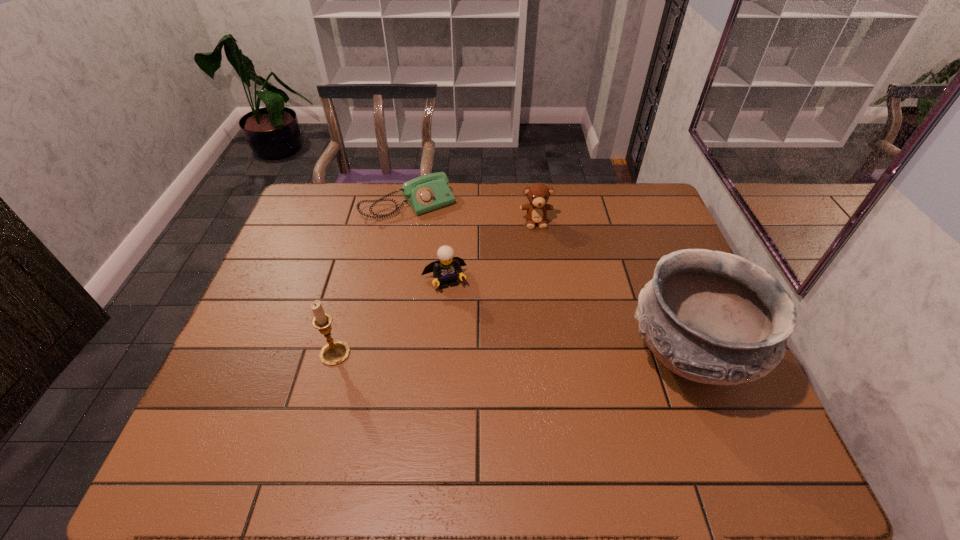
Locate an element on the screen. candle holder is located at coordinates (334, 353).

You are a GUI agent. You are given a task and a screenshot of the screen. Output one action in this format:
    pyautogui.click(x=<x>, y=<y>)
    Task: Click on the rightmost object
    This screenshot has width=960, height=540.
    Given the screenshot: What is the action you would take?
    pyautogui.click(x=712, y=317)

Locate an element on the screen. Image resolution: width=960 pixels, height=540 pixels. the tallest object is located at coordinates (712, 317).

Where is `the second object from right to left`? The image size is (960, 540). the second object from right to left is located at coordinates (538, 194).

The height and width of the screenshot is (540, 960). What are the coordinates of `Lego` in the screenshot? It's located at (447, 266).

You are a GUI agent. You are given a task and a screenshot of the screen. Output one action in this format:
    pyautogui.click(x=<x>, y=<y>)
    Task: Click on the telephone
    
    Given the screenshot: What is the action you would take?
    pyautogui.click(x=428, y=192)

This screenshot has width=960, height=540. Find the location of `vacant point located on the back of the fourth shortest object`. vacant point located on the back of the fourth shortest object is located at coordinates (362, 253).

Locate an element on the screen. The image size is (960, 540). vacant space located 0.200m on the left of the tallest object is located at coordinates (542, 356).

Image resolution: width=960 pixels, height=540 pixels. Identify the location of vacant region located on the face of the teddy bear. [x=541, y=260].

Where is `vacant region located 0.340m on the face of the teddy bear`? The width and height of the screenshot is (960, 540). vacant region located 0.340m on the face of the teddy bear is located at coordinates (x=548, y=311).